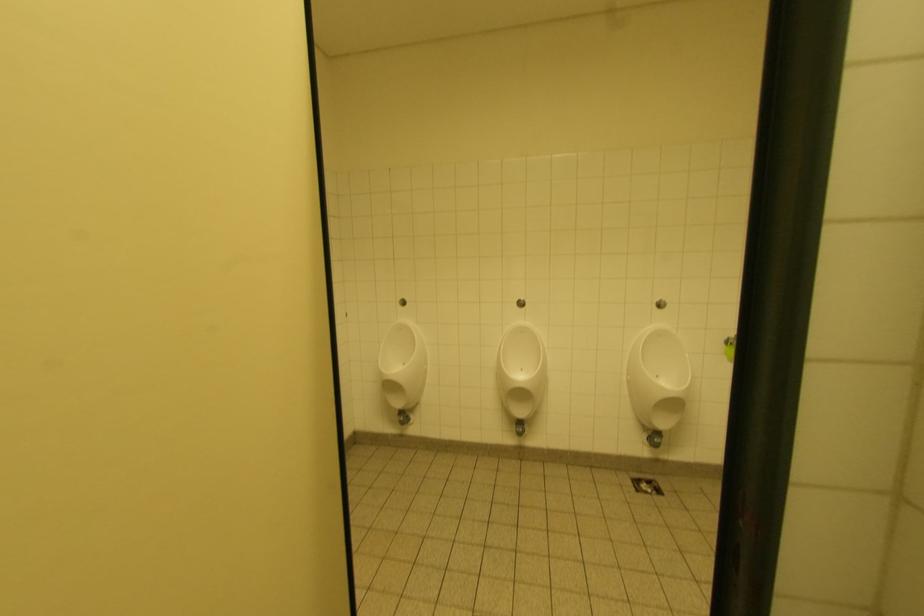
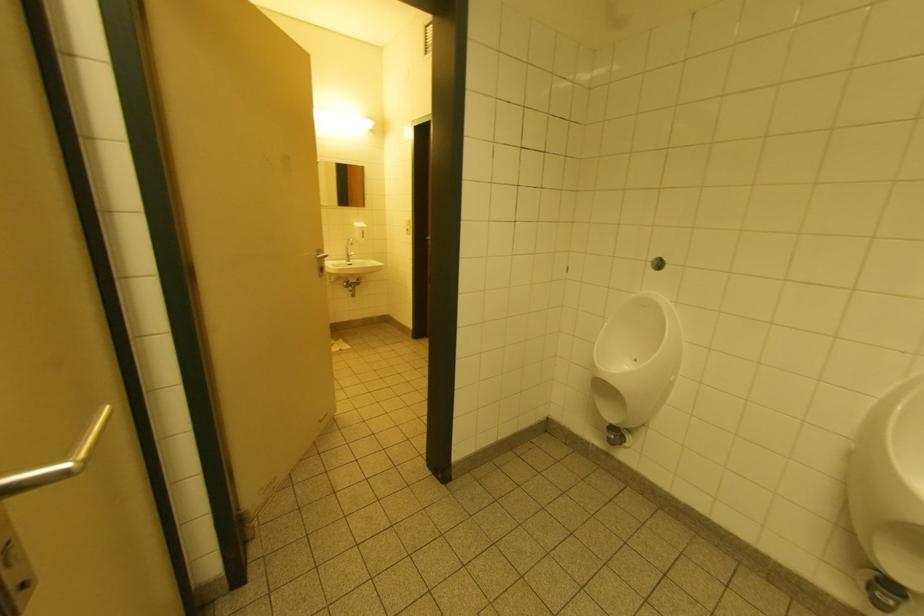
Question: How did the camera likely rotate?

Choices:
 (A) Left
 (B) Right
 (C) Up
 (D) Down

Answer: (A)